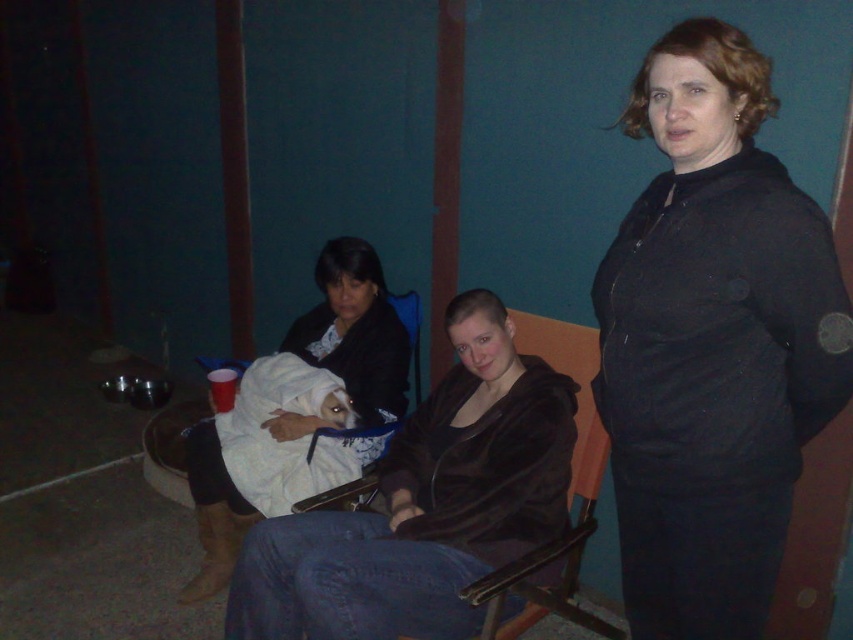
Is black matte jacket at center wider than white soft blanket at center?

No, black matte jacket at center is not wider than white soft blanket at center.

Who is higher up, black matte jacket at center or white soft blanket at center?

Positioned higher is black matte jacket at center.

Between point (785, 221) and point (328, 362), which one is positioned behind?

The point (328, 362) is more distant.

This screenshot has width=853, height=640. Find the location of `black matte jacket at center`. black matte jacket at center is located at coordinates (712, 342).

Can you confirm if white soft blanket at center is positioned to the left of white towel at center?

No, white soft blanket at center is not to the left of white towel at center.

Does white soft blanket at center have a greater height compared to white towel at center?

Indeed, white soft blanket at center has a greater height compared to white towel at center.

At what (x,y) coordinates should I click in order to perform the action: click on white soft blanket at center. Please return your answer as a coordinate pair (x, y). The width and height of the screenshot is (853, 640). Looking at the image, I should click on (355, 332).

In order to click on white soft blanket at center in this screenshot , I will do `click(355, 332)`.

Does black matte jacket at center have a smaller size compared to white towel at center?

No, black matte jacket at center is not smaller than white towel at center.

Based on the photo, which is more to the right, black matte jacket at center or white towel at center?

black matte jacket at center is more to the right.

The height and width of the screenshot is (640, 853). Describe the element at coordinates (712, 342) in the screenshot. I see `black matte jacket at center` at that location.

The image size is (853, 640). I want to click on black matte jacket at center, so click(712, 342).